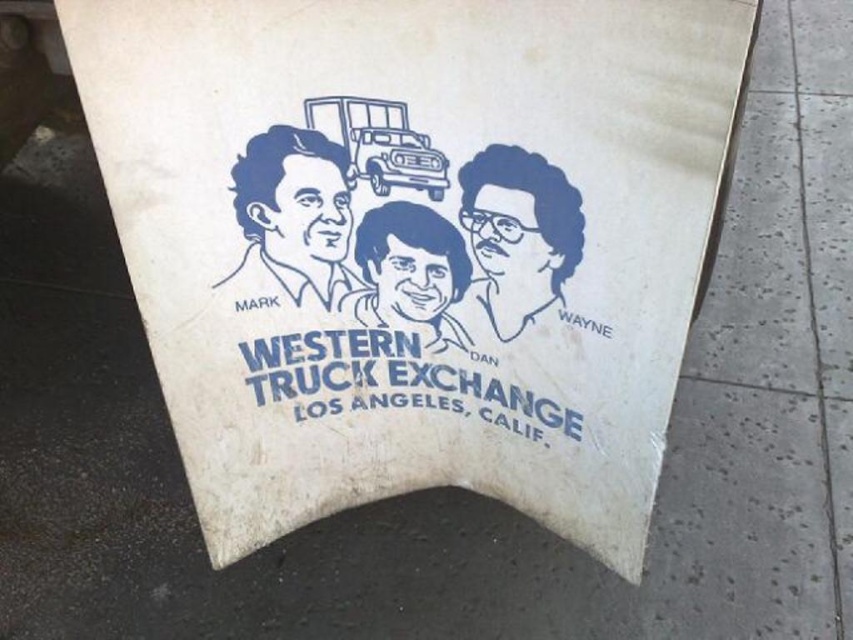
Which of these two, blue line drawing of man at center or matte blue head at center, stands taller?

Standing taller between the two is blue line drawing of man at center.

Who is more forward, [315,230] or [352,298]?

Positioned in front is point [315,230].

Measure the distance between blue line drawing of man at center and camera.

A distance of 37.85 inches exists between blue line drawing of man at center and camera.

The height and width of the screenshot is (640, 853). In order to click on blue line drawing of man at center in this screenshot , I will do `click(292, 220)`.

Is blue line drawing face at upper center positioned in front of matte blue head at center?

Yes, blue line drawing face at upper center is closer to the viewer.

Which of these two, blue line drawing face at upper center or matte blue head at center, stands shorter?

matte blue head at center is shorter.

I want to click on blue line drawing face at upper center, so click(x=515, y=240).

Locate an element on the screen. blue line drawing of man at center is located at coordinates (292, 220).

Describe the element at coordinates (292, 220) in the screenshot. I see `blue line drawing of man at center` at that location.

Find the location of `blue line drawing of man at center`. blue line drawing of man at center is located at coordinates (292, 220).